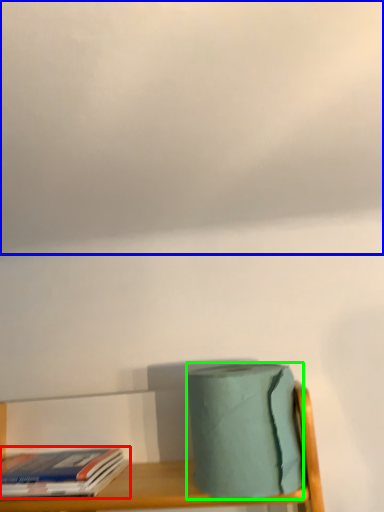
Question: Considering the real-world distances, which object is closest to book (highlighted by a red box)? cloud (highlighted by a blue box) or toilet paper (highlighted by a green box).

Choices:
 (A) cloud
 (B) toilet paper

Answer: (B)